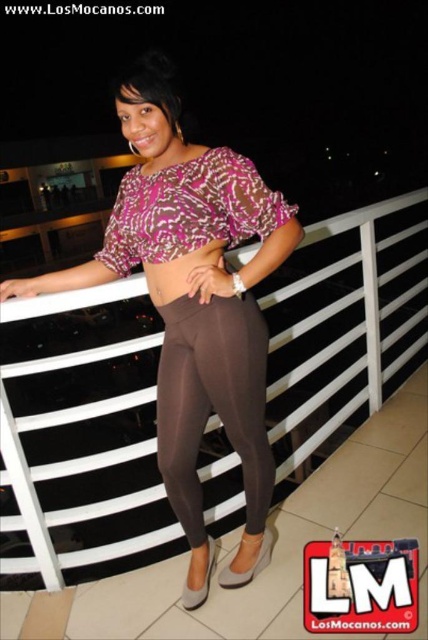
Question: Does brown smooth leggings at center have a larger size compared to brown matte leggings at center?

Choices:
 (A) no
 (B) yes

Answer: (B)

Question: Which object is closer to the camera taking this photo?

Choices:
 (A) brown matte leggings at center
 (B) matte brown leggings at center

Answer: (B)

Question: Is matte brown leggings at center above brown smooth leggings at center?

Choices:
 (A) no
 (B) yes

Answer: (B)

Question: Which point appears closest to the camera in this image?

Choices:
 (A) (240, 317)
 (B) (205, 252)

Answer: (B)

Question: Can you confirm if matte brown leggings at center is bigger than brown matte leggings at center?

Choices:
 (A) yes
 (B) no

Answer: (A)

Question: Among these points, which one is farthest from the camera?

Choices:
 (A) (162, 282)
 (B) (169, 330)
 (C) (175, 484)

Answer: (C)